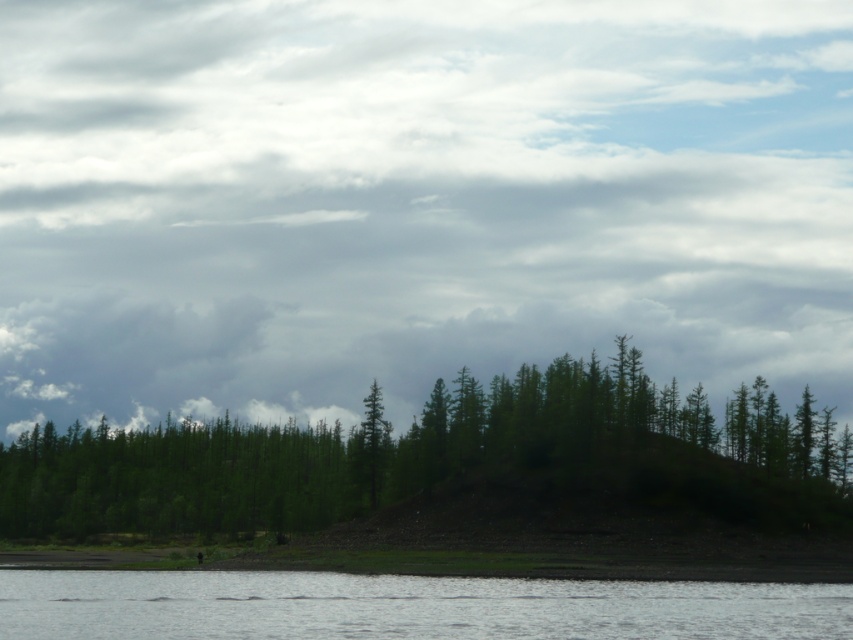
Question: Considering the real-world distances, which object is closest to the clear water at lower center?

Choices:
 (A) cloudy sky at upper center
 (B) green matte forest at center
 (C) green matte tree at center

Answer: (B)

Question: Can you confirm if clear water at lower center is bigger than green matte tree at center?

Choices:
 (A) no
 (B) yes

Answer: (B)

Question: Which object appears farthest from the camera in this image?

Choices:
 (A) green matte forest at center
 (B) green matte tree at center
 (C) clear water at lower center
 (D) cloudy sky at upper center

Answer: (B)

Question: Does green matte forest at center appear on the right side of clear water at lower center?

Choices:
 (A) yes
 (B) no

Answer: (B)

Question: Is clear water at lower center positioned behind green matte tree at center?

Choices:
 (A) yes
 (B) no

Answer: (B)

Question: Which point appears closest to the camera in this image?

Choices:
 (A) (662, 476)
 (B) (235, 588)
 (C) (753, 192)
 (D) (357, 484)

Answer: (B)